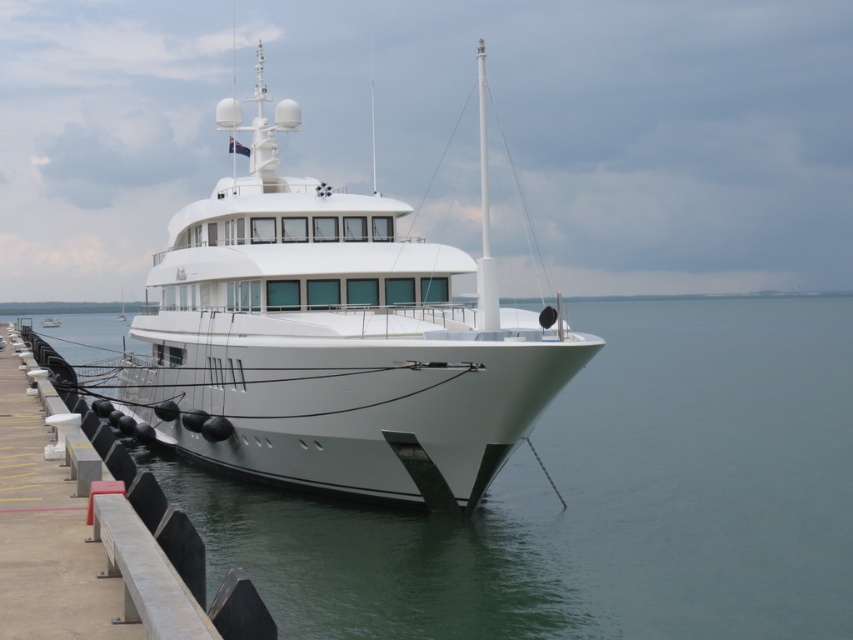
Based on the photo, you are standing on the dock next to the yacht. You want to take a photo of the yacht with your camera. The camera is at your eye level. Where should you position yourself so that the point at coordinates point (589, 612) is in the center of the photo?

You should position yourself 12.95 meters away from the point (589, 612) to ensure it is centered in your photo.